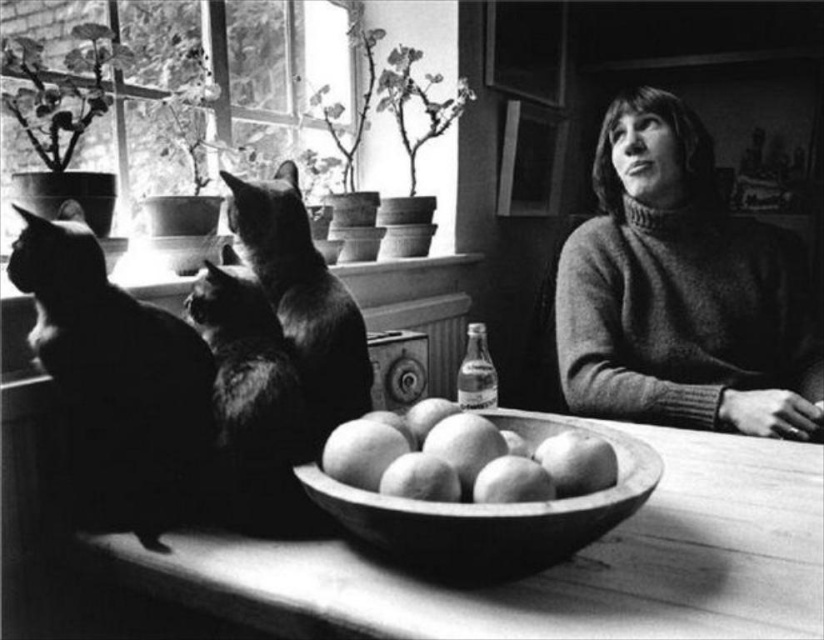
Question: Considering the real-world distances, which object is farthest from the soft fur cat at center?

Choices:
 (A) silky fur cat at center
 (B) smooth wooden bowl at center
 (C) wooden bowl at center

Answer: (C)

Question: Can you confirm if smooth wooden bowl at center is bigger than soft fur cat at center?

Choices:
 (A) yes
 (B) no

Answer: (B)

Question: Is silhouette fur cat at left bigger than soft fur cat at center?

Choices:
 (A) no
 (B) yes

Answer: (B)

Question: Can you confirm if wooden bowl at center is thinner than soft fur cat at center?

Choices:
 (A) yes
 (B) no

Answer: (B)

Question: Estimate the real-world distances between objects in this image. Which object is closer to the silky fur cat at center?

Choices:
 (A) soft fur cat at center
 (B) smooth wooden bowl at center
 (C) silhouette fur cat at left

Answer: (A)

Question: Which object is the farthest from the silky fur cat at center?

Choices:
 (A) silhouette fur cat at left
 (B) soft fur cat at center
 (C) knitted sweater at right
 (D) smooth wooden bowl at center

Answer: (C)